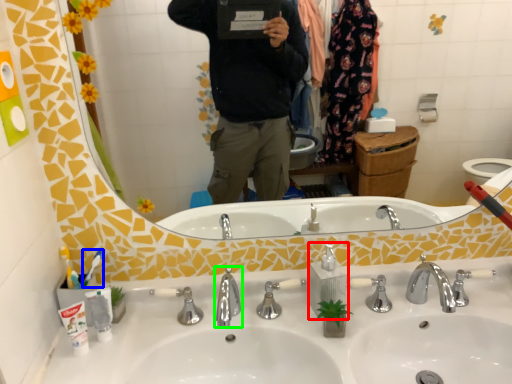
Question: Considering the real-world distances, which object is farthest from soap dispenser (highlighted by a red box)? toothbrush (highlighted by a blue box) or tap (highlighted by a green box)?

Choices:
 (A) toothbrush
 (B) tap

Answer: (A)